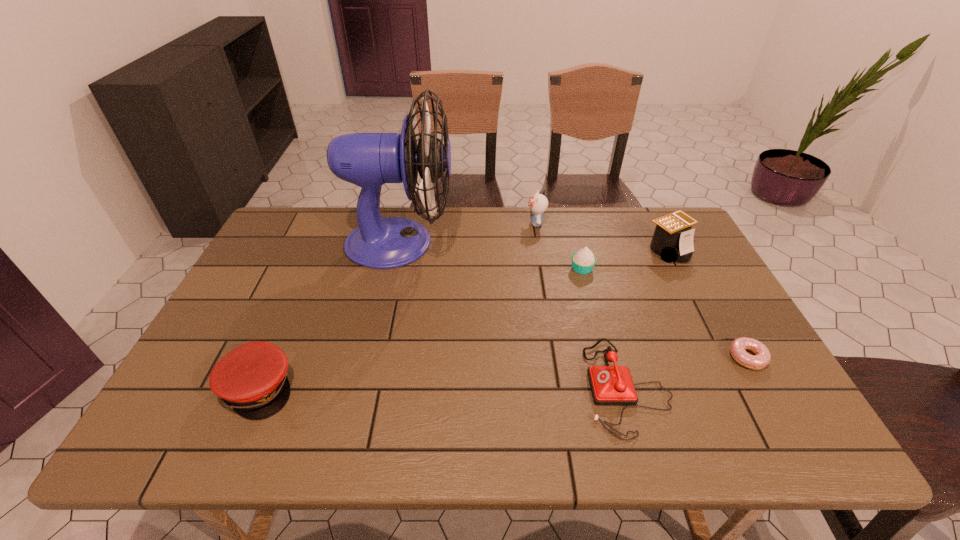
Where is `fan`? The width and height of the screenshot is (960, 540). fan is located at coordinates (369, 160).

Identify the location of the third object from left to right. This screenshot has height=540, width=960. (538, 203).

Find the location of a particular element. This screenshot has width=960, height=540. calculator is located at coordinates (673, 238).

Locate an element on the screen. cupcake is located at coordinates (583, 261).

Locate an element on the screen. The width and height of the screenshot is (960, 540). cap is located at coordinates (251, 379).

At what (x,y) coordinates should I click in order to perform the action: click on telephone. Please return your answer as a coordinate pair (x, y). The height and width of the screenshot is (540, 960). Looking at the image, I should click on (610, 385).

Locate an element on the screen. This screenshot has height=540, width=960. doughnut is located at coordinates (738, 347).

You are a GUI agent. You are given a task and a screenshot of the screen. Output one action in this format:
    pyautogui.click(x=<x>, y=<y>)
    Task: Click on the free space located 0.310m in front of the fan where the airflow is directed
    
    Given the screenshot: What is the action you would take?
    point(551,243)

Identify the location of free space located on the front-facing side of the third object from left to right. The height and width of the screenshot is (540, 960). (426, 223).

The image size is (960, 540). Identify the location of vacant area located on the front-facing side of the third object from left to right. (462, 223).